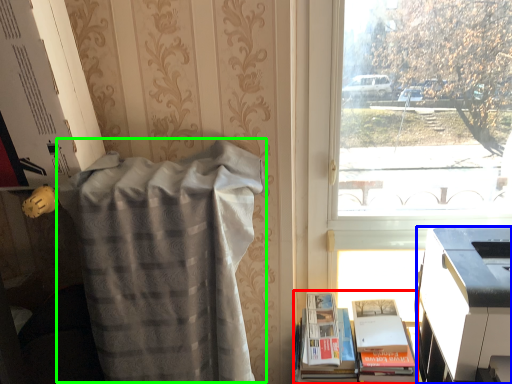
Question: Which is nearer to the book (highlighted by a red box)? printer (highlighted by a blue box) or blanket (highlighted by a green box).

Choices:
 (A) printer
 (B) blanket

Answer: (A)